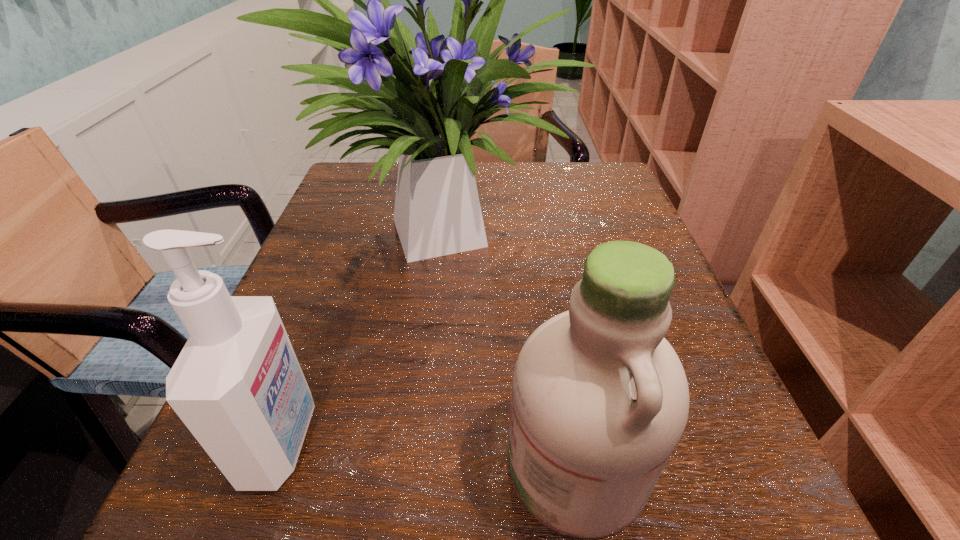
This screenshot has height=540, width=960. I want to click on object situated at the far left corner, so click(x=437, y=212).

Find the location of a particular element. object present at the near left corner is located at coordinates (237, 385).

I want to click on object that is positioned at the far right corner, so click(x=437, y=212).

What are the coordinates of `free region at the far edge of the desktop` in the screenshot? It's located at (524, 196).

This screenshot has height=540, width=960. I want to click on vacant area at the near edge of the desktop, so click(385, 471).

In the image, there is a desktop. Where is `vacant space at the left edge`? vacant space at the left edge is located at coordinates (335, 309).

Locate an element on the screen. The width and height of the screenshot is (960, 540). blank space at the right edge is located at coordinates (724, 433).

In the image, there is a desktop. Where is `vacant space at the far left corner`? vacant space at the far left corner is located at coordinates (355, 175).

At what (x,y) coordinates should I click in order to perform the action: click on free space at the far right corner of the desktop. Please return your answer as a coordinate pair (x, y). Looking at the image, I should click on (627, 212).

Identify the location of free spot between the left cleansing agent and the flower arrangement. The image size is (960, 540). point(366,333).